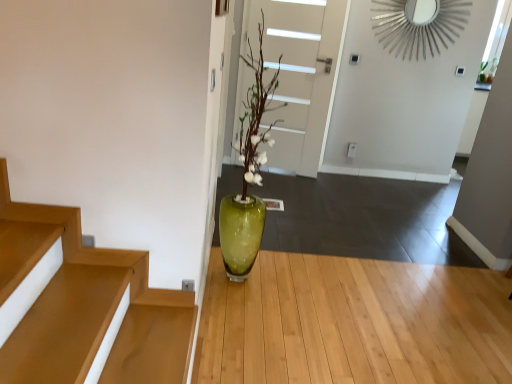
Question: From the image's perspective, relative to white matte door at center, is green glass vase at center above or below?

Choices:
 (A) above
 (B) below

Answer: (B)

Question: Relative to white matte door at center, is green glass vase at center in front or behind?

Choices:
 (A) behind
 (B) front

Answer: (B)

Question: Based on their relative distances, which object is farther from the green glass vase at center?

Choices:
 (A) green glass vase at center
 (B) white matte door at center

Answer: (B)

Question: Estimate the real-world distances between objects in this image. Which object is farther from the green glass vase at center?

Choices:
 (A) white matte door at center
 (B) green glass vase at center

Answer: (A)